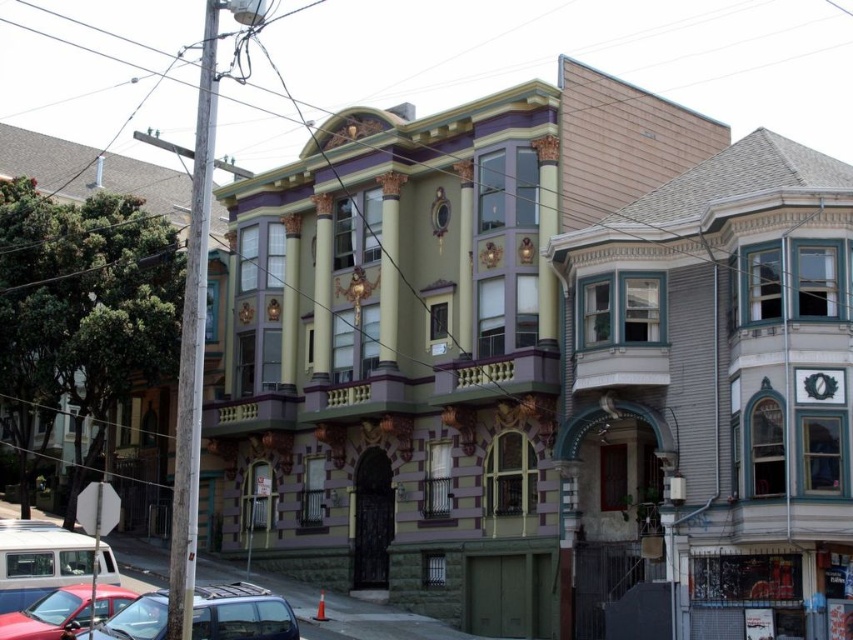
Which is above, shiny black car at lower left or shiny red car at lower left?

Positioned higher is shiny red car at lower left.

Does point (193, 595) lie in front of point (70, 586)?

Yes, it is.

In order to click on shiny black car at lower left in this screenshot , I will do `click(241, 612)`.